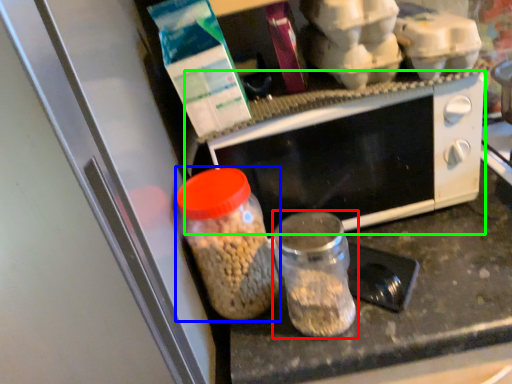
Question: Which object is positioned farthest from bottle (highlighted by a red box)? Select from bottle (highlighted by a blue box) and microwave oven (highlighted by a green box).

Choices:
 (A) bottle
 (B) microwave oven

Answer: (B)